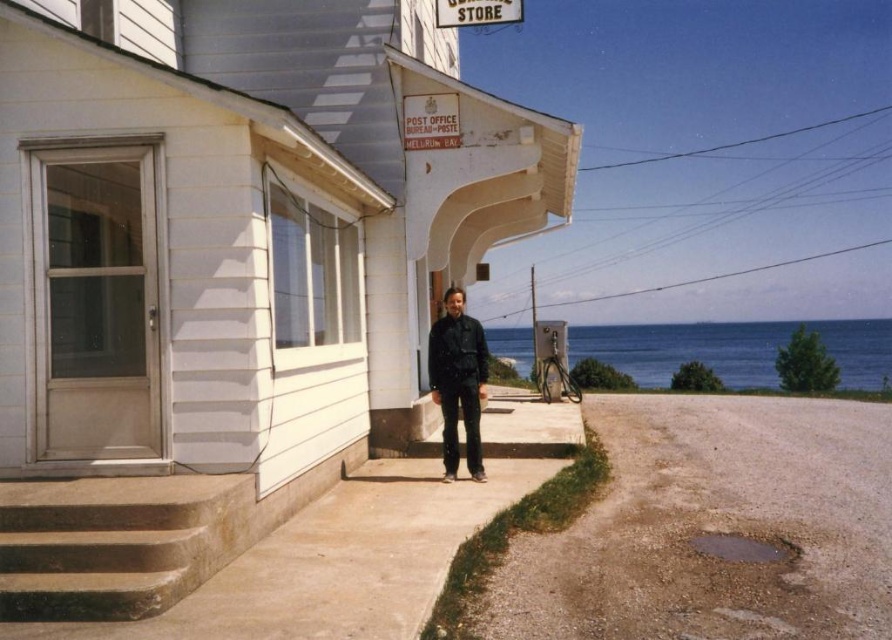
Between dull gray asphalt at lower right and black matte jacket at center, which one has more height?

black matte jacket at center

Is point (816, 424) farther from camera compared to point (434, 358)?

Yes, point (816, 424) is farther from viewer.

Who is more distant from viewer, (871,486) or (443,422)?

Positioned behind is point (443,422).

Find the location of a particular element. This screenshot has width=892, height=640. dull gray asphalt at lower right is located at coordinates (715, 528).

Does blue water at lower right have a lesser width compared to black matte jacket at center?

In fact, blue water at lower right might be wider than black matte jacket at center.

Measure the distance between point [692,340] and camera.

They are 164.71 feet apart.

You are a GUI agent. You are given a task and a screenshot of the screen. Output one action in this format:
    pyautogui.click(x=<x>, y=<y>)
    Task: Click on the blue water at lower right
    
    Given the screenshot: What is the action you would take?
    pyautogui.click(x=734, y=349)

Between dull gray asphalt at lower right and brown concrete stairs at lower left, which one has less height?

With less height is dull gray asphalt at lower right.

How far apart are dull gray asphalt at lower right and brown concrete stairs at lower left?

3.41 meters

Which is behind, point (629, 608) or point (183, 589)?

Positioned behind is point (629, 608).

You are a GUI agent. You are given a task and a screenshot of the screen. Output one action in this format:
    pyautogui.click(x=<x>, y=<y>)
    Task: Click on the dull gray asphalt at lower right
    This screenshot has height=640, width=892.
    Given the screenshot: What is the action you would take?
    pyautogui.click(x=715, y=528)